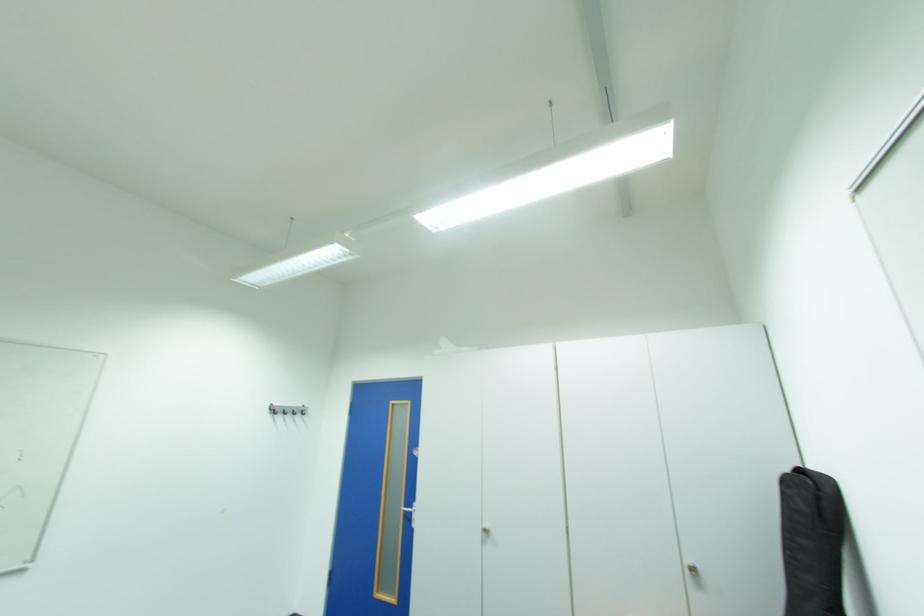
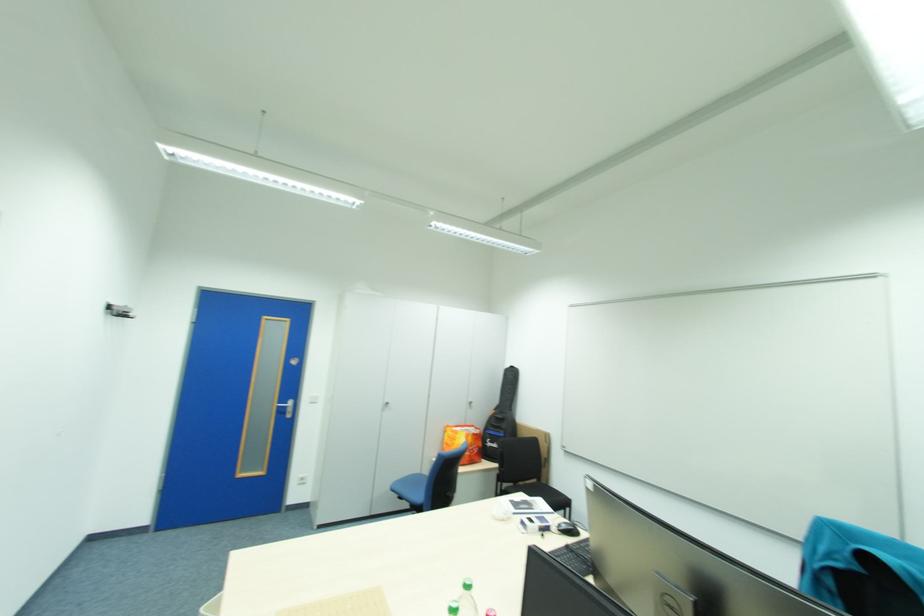
The point at (414, 511) is marked in the first image. Where is the corresponding point in the second image?

(286, 407)